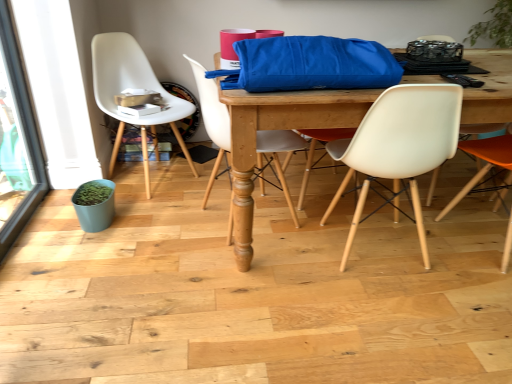
Question: From a real-world perspective, does blue fabric bag at center sit lower than black plastic remote control at upper right?

Choices:
 (A) yes
 (B) no

Answer: (A)

Question: Is blue fabric bag at center taller than black plastic remote control at upper right?

Choices:
 (A) yes
 (B) no

Answer: (A)

Question: From a real-world perspective, is blue fabric bag at center located higher than black plastic remote control at upper right?

Choices:
 (A) yes
 (B) no

Answer: (B)

Question: Is blue fabric bag at center closer to the viewer compared to black plastic remote control at upper right?

Choices:
 (A) no
 (B) yes

Answer: (B)

Question: Is blue fabric bag at center turned away from black plastic remote control at upper right?

Choices:
 (A) no
 (B) yes

Answer: (A)

Question: Considering the positions of orange matte chair at right, the 4th chair viewed from the left, and transparent glass screen door at left in the image, is orange matte chair at right, the 4th chair viewed from the left, wider or thinner than transparent glass screen door at left?

Choices:
 (A) wide
 (B) thin

Answer: (A)

Question: Considering the positions of orange matte chair at right, which is the 1th chair from right to left, and transparent glass screen door at left in the image, is orange matte chair at right, which is the 1th chair from right to left, taller or shorter than transparent glass screen door at left?

Choices:
 (A) tall
 (B) short

Answer: (B)

Question: Based on their sizes in the image, would you say orange matte chair at right, the 4th chair viewed from the left, is bigger or smaller than transparent glass screen door at left?

Choices:
 (A) small
 (B) big

Answer: (B)

Question: Choose the correct answer: Is orange matte chair at right, which is the 1th chair from right to left, inside transparent glass screen door at left or outside it?

Choices:
 (A) inside
 (B) outside

Answer: (B)

Question: Is black plastic remote control at upper right inside or outside of white plastic chair at left, positioned as the first chair in left-to-right order?

Choices:
 (A) outside
 (B) inside

Answer: (A)

Question: Is black plastic remote control at upper right in front of or behind white plastic chair at left, the 4th chair when ordered from right to left, in the image?

Choices:
 (A) front
 (B) behind

Answer: (A)

Question: Is black plastic remote control at upper right bigger or smaller than white plastic chair at left, positioned as the first chair in left-to-right order?

Choices:
 (A) small
 (B) big

Answer: (A)

Question: From a real-world perspective, is black plastic remote control at upper right above or below white plastic chair at left, positioned as the first chair in left-to-right order?

Choices:
 (A) above
 (B) below

Answer: (A)

Question: From a real-world perspective, relative to black plastic remote control at upper right, is orange matte chair at right, the 4th chair viewed from the left, vertically above or below?

Choices:
 (A) below
 (B) above

Answer: (A)

Question: Which is correct: orange matte chair at right, which is the 1th chair from right to left, is inside black plastic remote control at upper right, or outside of it?

Choices:
 (A) outside
 (B) inside

Answer: (A)